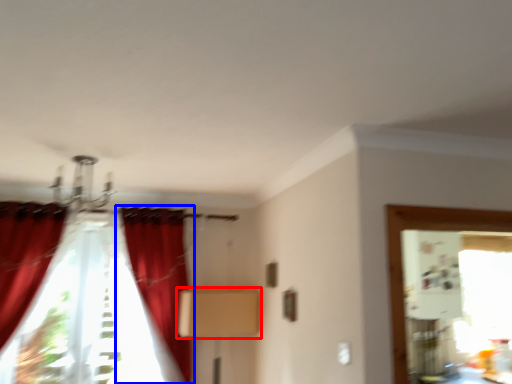
Question: Which point is closer to the camera, cardboard box (highlighted by a red box) or curtain (highlighted by a blue box)?

Choices:
 (A) cardboard box
 (B) curtain

Answer: (B)